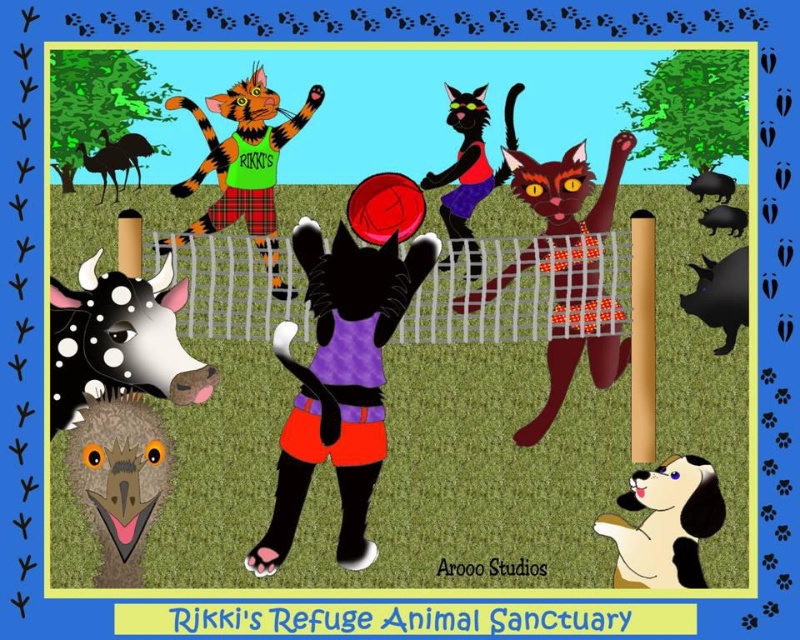
You are an animal sanctuary volunteer observing the volleyball game between the purple fabric cat at center and the black rubber pig at right. Which animal is taller?

The purple fabric cat at center is taller than the black rubber pig at right according to the description.